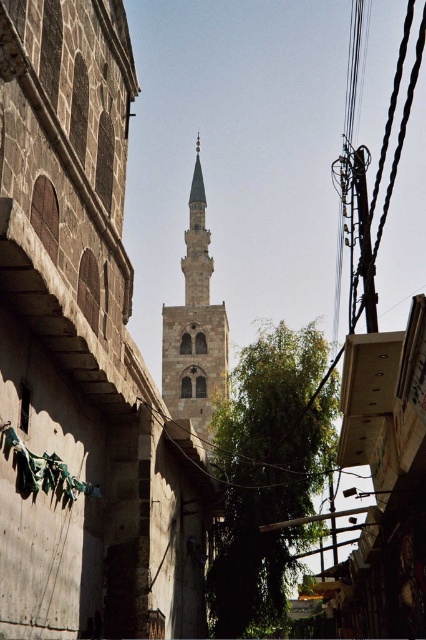
Question: Can you confirm if stone minaret at center is smaller than smooth white minaret at center?

Choices:
 (A) no
 (B) yes

Answer: (A)

Question: Is brown stone minaret at center positioned in front of black wire at right?

Choices:
 (A) yes
 (B) no

Answer: (A)

Question: Which object appears closest to the camera in this image?

Choices:
 (A) smooth white minaret at center
 (B) stone minaret at center
 (C) black wire at right
 (D) brown stone minaret at center

Answer: (D)

Question: Is brown stone minaret at center smaller than black wire at right?

Choices:
 (A) yes
 (B) no

Answer: (A)

Question: Which point is farther to the camera?

Choices:
 (A) coord(397,81)
 (B) coord(16,172)
 (C) coord(198,282)

Answer: (A)

Question: Which point is closer to the camera taking this photo?

Choices:
 (A) (204, 273)
 (B) (396, 164)

Answer: (A)